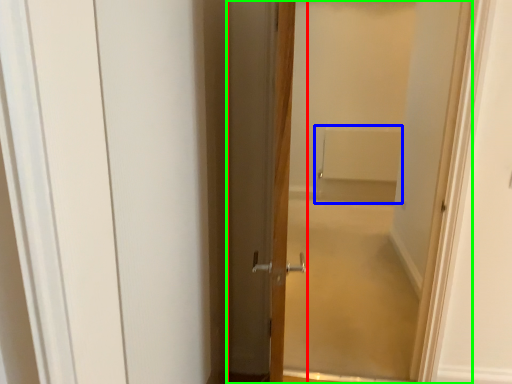
Question: Which is nearer to the door (highlighted by a red box)? bath (highlighted by a blue box) or door (highlighted by a green box).

Choices:
 (A) bath
 (B) door

Answer: (B)